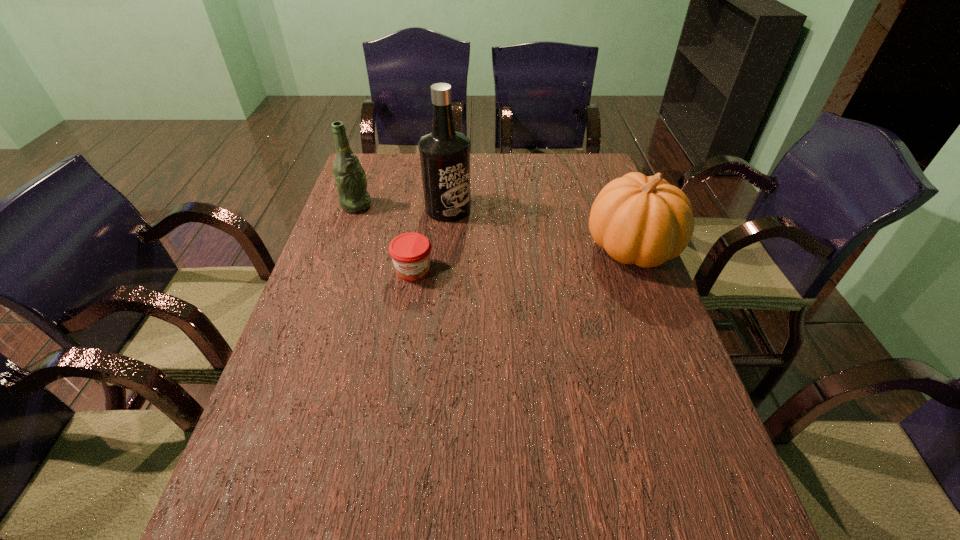
This screenshot has height=540, width=960. Identify the location of free space on the desktop that is between the jam and the rightmost object and is positioned on the front label of the tallest object. (529, 259).

Image resolution: width=960 pixels, height=540 pixels. What are the coordinates of `vacant space on the desktop that is between the shortest object and the rightmost object and is positioned on the surface of the leftmost object` in the screenshot? It's located at (518, 260).